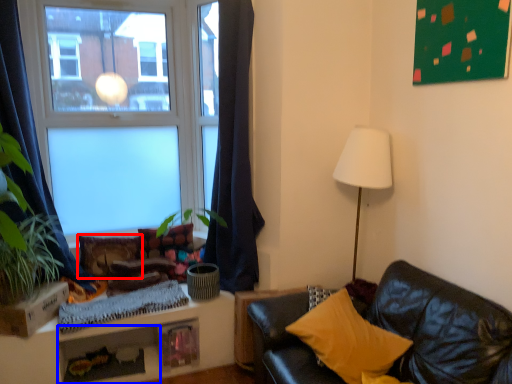
Question: Which of the following is the farthest to the observer, pillow (highlighted by a red box) or shelf (highlighted by a blue box)?

Choices:
 (A) pillow
 (B) shelf

Answer: (A)